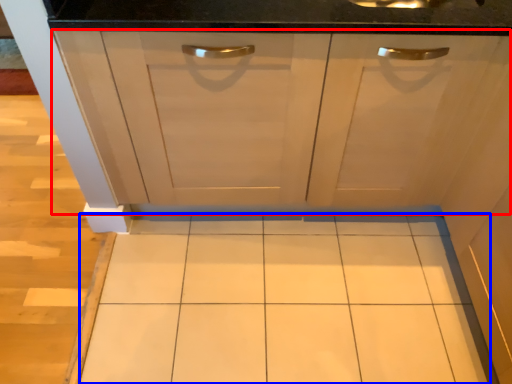
Question: Among these objects, which one is nearest to the camera, cabinetry (highlighted by a red box) or ceramic tile (highlighted by a blue box)?

Choices:
 (A) cabinetry
 (B) ceramic tile

Answer: (A)